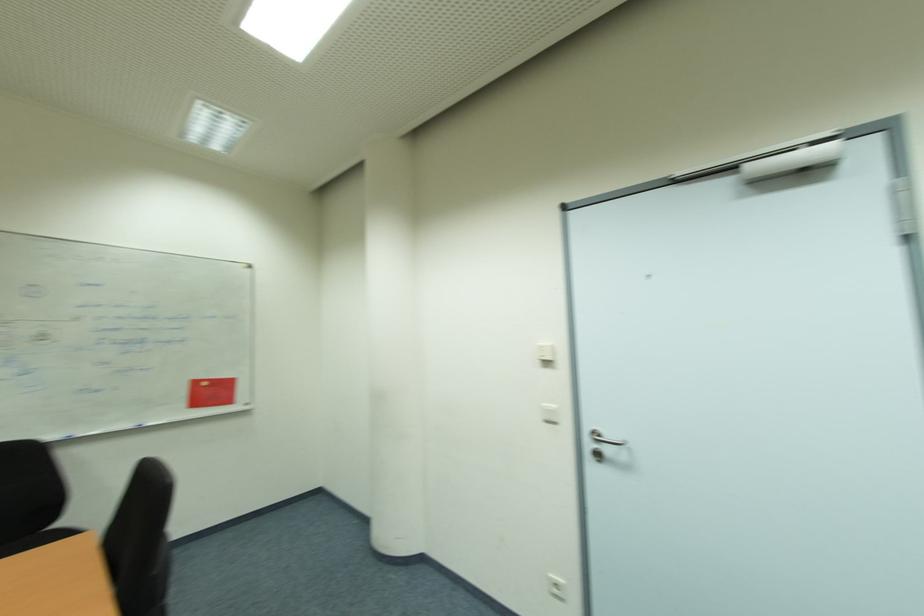
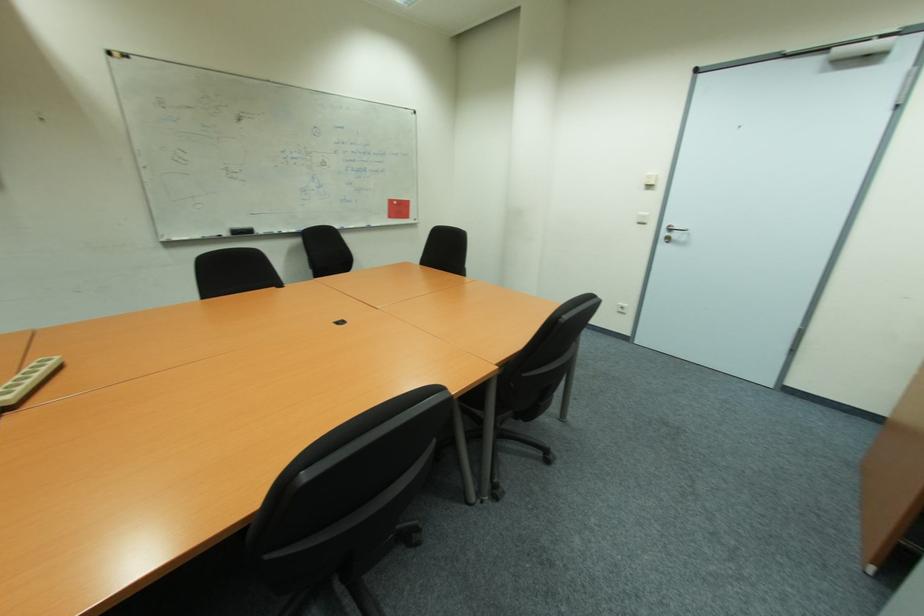
The images are taken continuously from a first-person perspective. In which direction are you moving?

The cameraman moved toward left, backward.